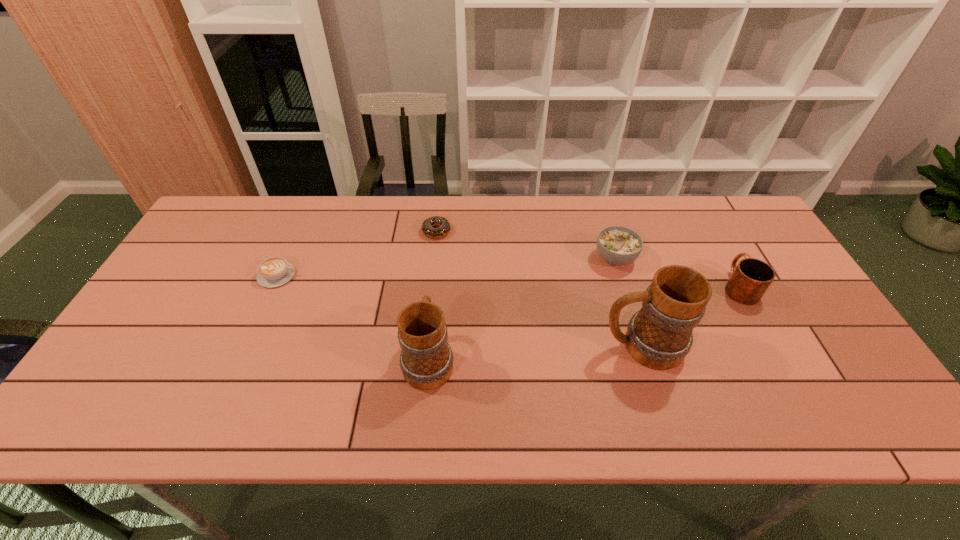
The height and width of the screenshot is (540, 960). What are the coordinates of `vacant space located on the side of the rightmost mug with the handle` in the screenshot? It's located at pos(709,233).

The height and width of the screenshot is (540, 960). Identify the location of vacant space positioned 0.290m on the side of the rightmost mug with the handle. (695, 208).

This screenshot has width=960, height=540. I want to click on free space located 0.080m on the side of the leftmost object with the handle, so click(x=324, y=275).

Where is `doughnut at the far edge`? doughnut at the far edge is located at coordinates (444, 226).

Identify the location of soup bowl located in the far edge section of the desktop. (617, 245).

In order to click on object located in the right edge section of the desktop in this screenshot , I will do `click(750, 279)`.

The image size is (960, 540). I want to click on blank space at the far edge of the desktop, so click(x=500, y=217).

In the image, there is a desktop. Where is `free space at the near edge`? This screenshot has width=960, height=540. free space at the near edge is located at coordinates (486, 366).

This screenshot has height=540, width=960. What are the coordinates of `vacant space at the left edge of the desktop` in the screenshot? It's located at (174, 343).

This screenshot has width=960, height=540. I want to click on vacant region at the right edge, so click(781, 307).